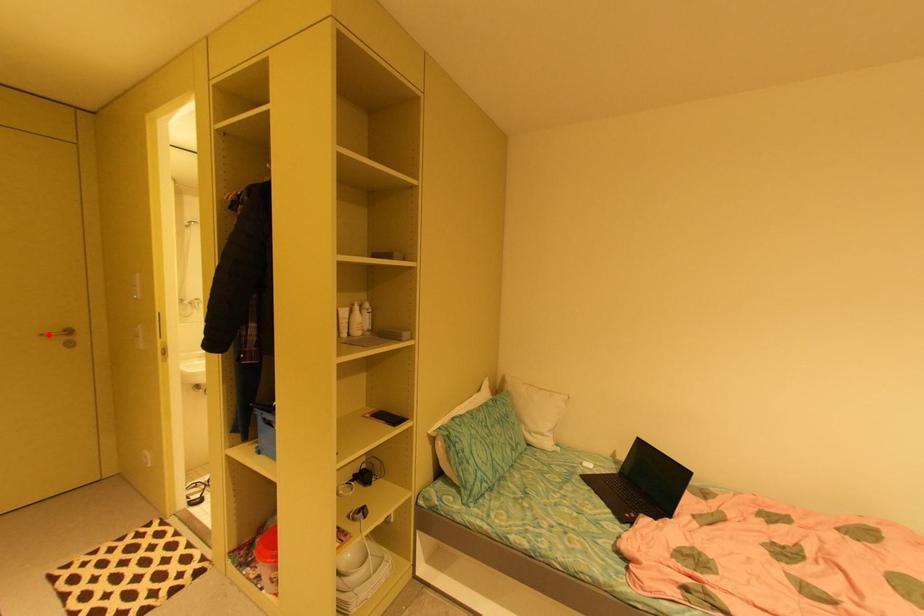
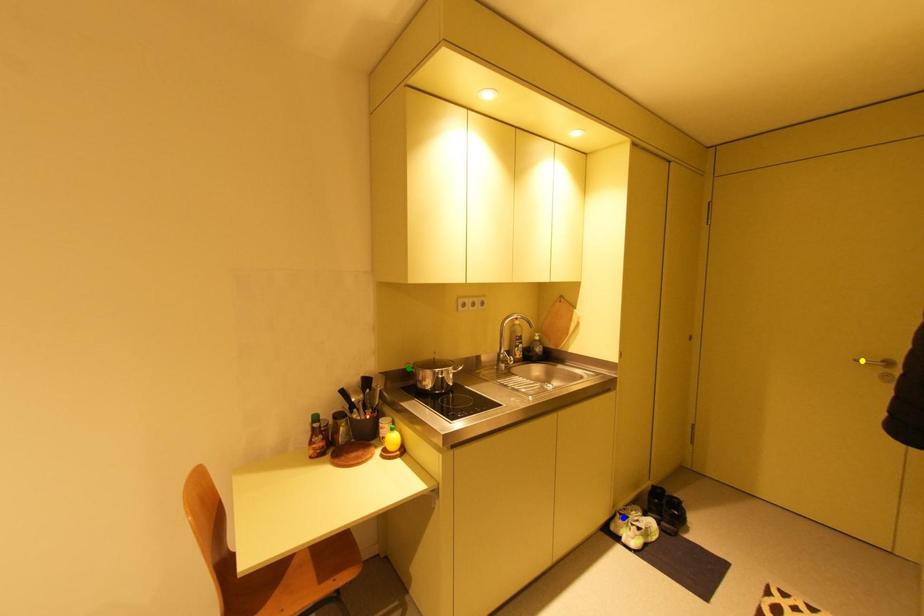
Question: I am providing you with two images of the same scene from different viewpoints. A red point is marked on the first image. You are given multiple points on the second image. In image 2, which mark is for the same physical point as the one in image 1?

Choices:
 (A) green point
 (B) blue point
 (C) yellow point

Answer: (C)